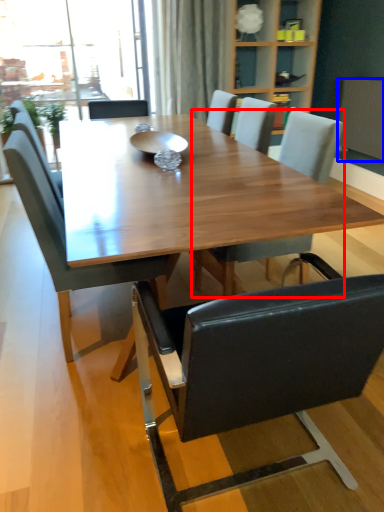
Question: Among these objects, which one is farthest to the camera, chair (highlighted by a red box) or radiator (highlighted by a blue box)?

Choices:
 (A) chair
 (B) radiator

Answer: (B)